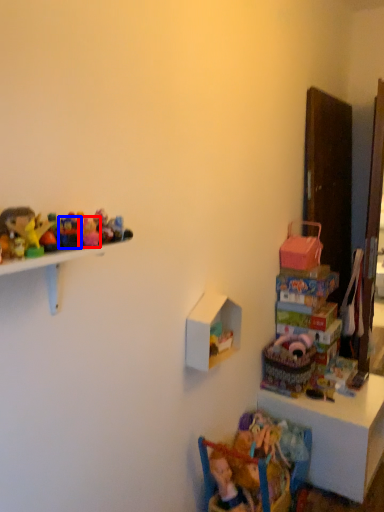
Question: Which of the following is the closest to the observer, toy (highlighted by a red box) or toy (highlighted by a blue box)?

Choices:
 (A) toy
 (B) toy

Answer: (B)